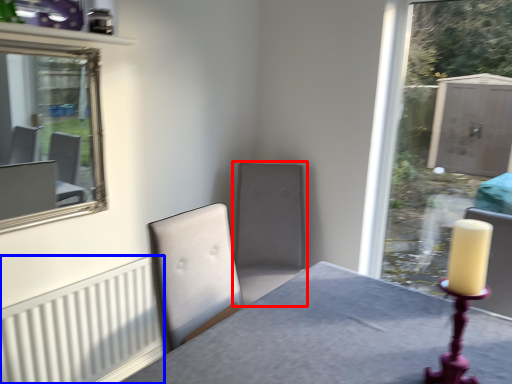
Question: Which point is closer to the camera, swivel chair (highlighted by a red box) or radiator (highlighted by a blue box)?

Choices:
 (A) swivel chair
 (B) radiator

Answer: (B)